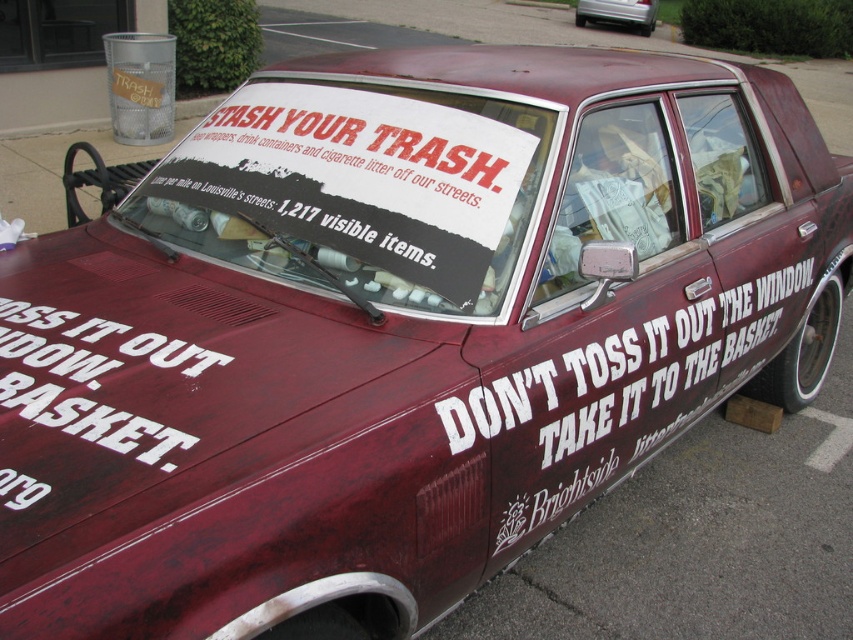
Question: Which object appears farthest from the camera in this image?

Choices:
 (A) white painted text at lower left
 (B) maroon matte car at center

Answer: (B)

Question: Can you confirm if white painted text at lower left is positioned to the left of maroon matte car at center?

Choices:
 (A) no
 (B) yes

Answer: (B)

Question: In this image, where is white painted text at lower left located relative to maroon matte car at center?

Choices:
 (A) below
 (B) above

Answer: (A)

Question: Is white painted text at lower left closer to the viewer compared to maroon matte car at center?

Choices:
 (A) yes
 (B) no

Answer: (A)